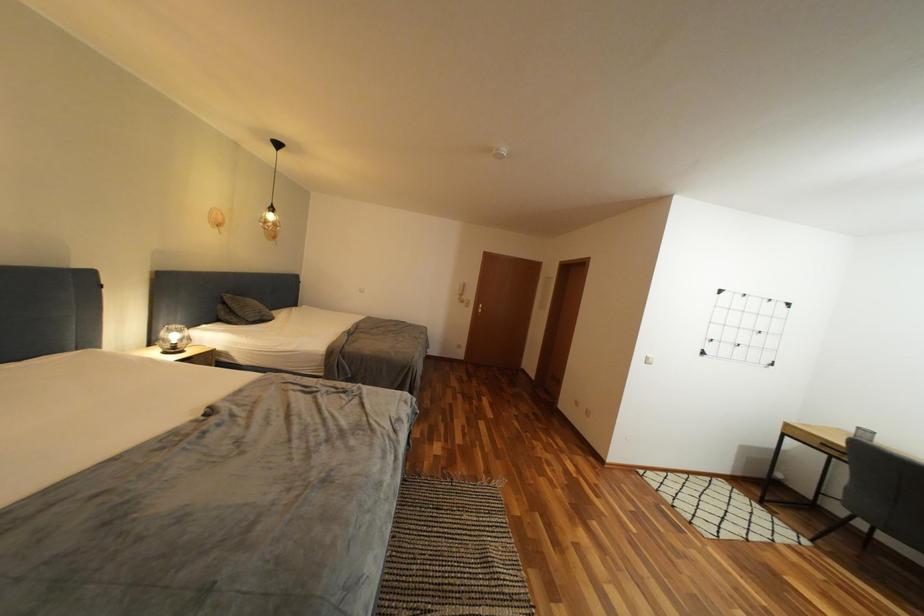
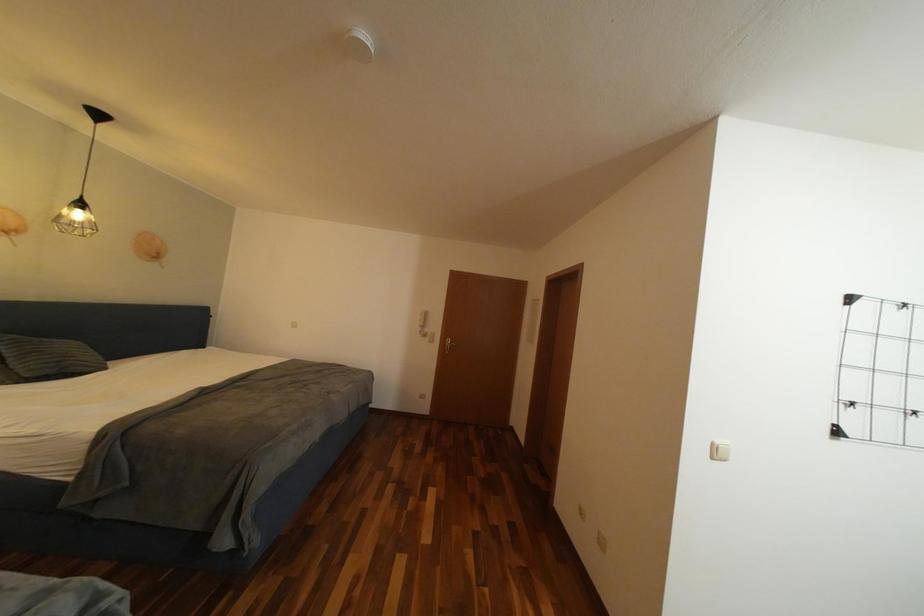
What movement of the cameraman would produce the second image?

The movement direction of the cameraman is right, forward.